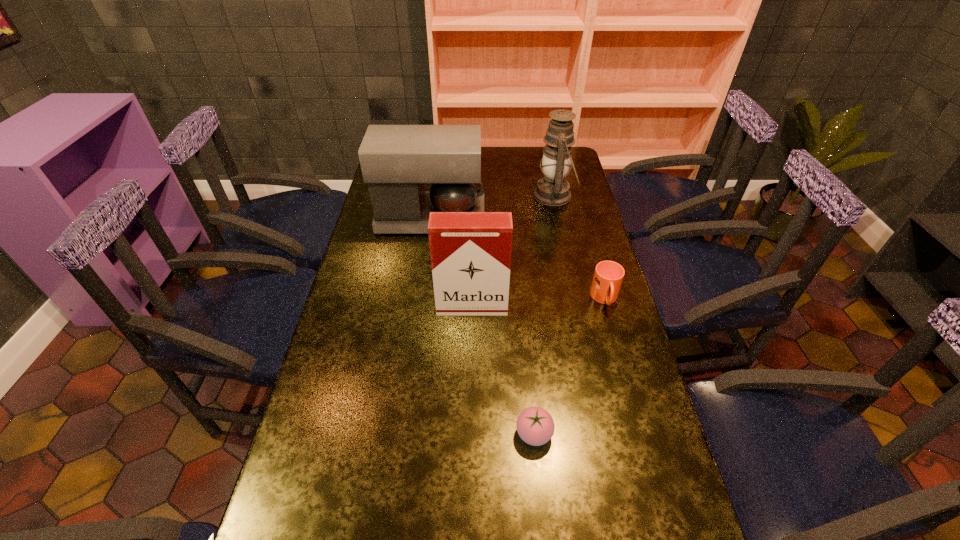
The image size is (960, 540). I want to click on oil lamp, so [x=553, y=190].

Locate an element on the screen. The width and height of the screenshot is (960, 540). coffee maker is located at coordinates (397, 161).

You are a GUI agent. You are given a task and a screenshot of the screen. Output one action in this format:
    pyautogui.click(x=<x>, y=<y>)
    Task: Click on the cigarette_case
    Image resolution: width=960 pixels, height=540 pixels.
    Given the screenshot: What is the action you would take?
    pyautogui.click(x=470, y=252)

In order to click on mug in this screenshot , I will do `click(608, 276)`.

Locate an element on the screen. This screenshot has width=960, height=540. tomato is located at coordinates (535, 426).

This screenshot has width=960, height=540. What are the coordinates of `the shortest object` in the screenshot? It's located at (535, 426).

Identify the location of free space located on the back of the oil lamp. The height and width of the screenshot is (540, 960). (548, 168).

Find the location of `free space located on the carafe side of the coffee maker`. free space located on the carafe side of the coffee maker is located at coordinates (579, 219).

In order to click on free space located 0.270m on the front-facing side of the cigarette_case in this screenshot , I will do `click(470, 397)`.

Locate an element on the screen. The width and height of the screenshot is (960, 540). free region located on the handle side of the fourth tallest object is located at coordinates [640, 426].